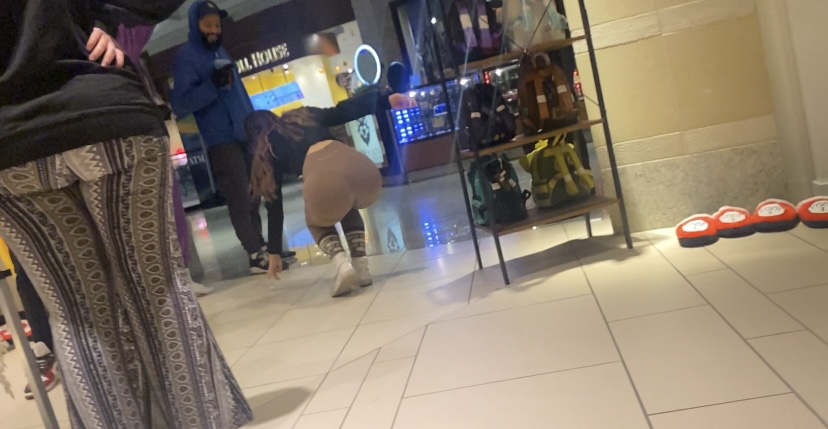
This screenshot has width=828, height=429. In order to click on metallic product shelf in this screenshot , I will do `click(454, 51)`.